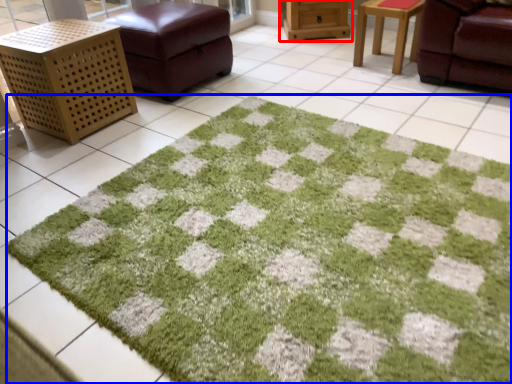
Question: Which object is closer to the camera taking this photo, furniture (highlighted by a red box) or bath mat (highlighted by a blue box)?

Choices:
 (A) furniture
 (B) bath mat

Answer: (B)